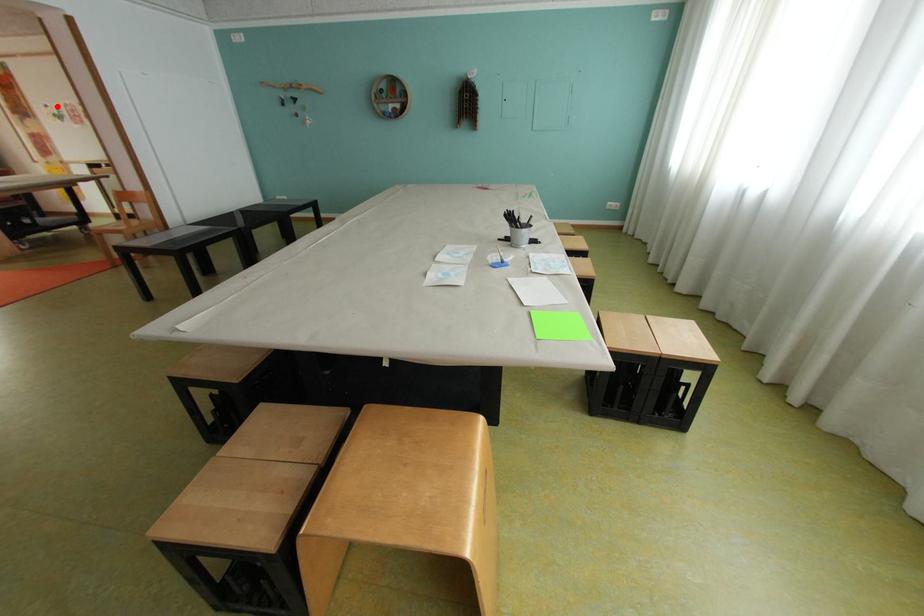
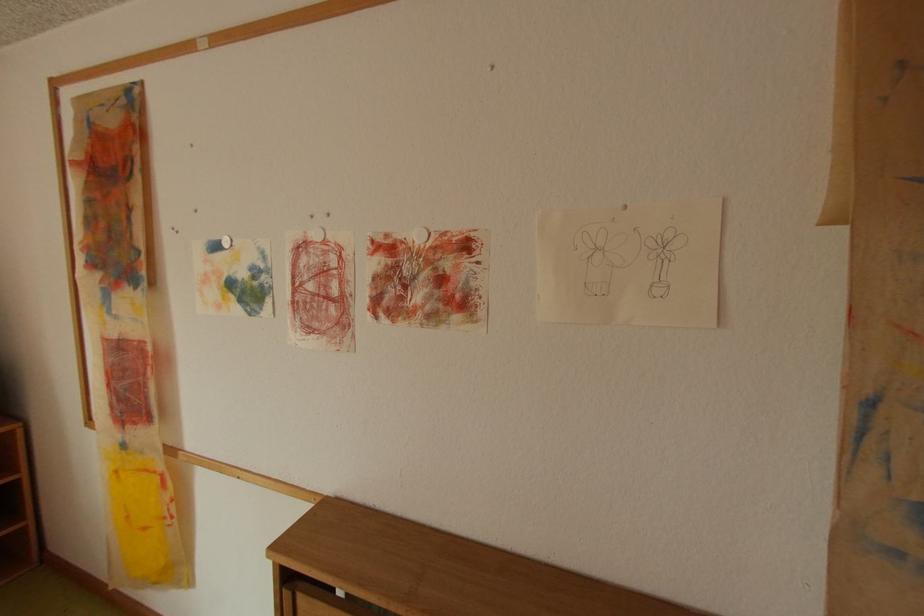
The point at the highlighted location is marked in the first image. Where is the corresponding point in the second image?

(225, 246)